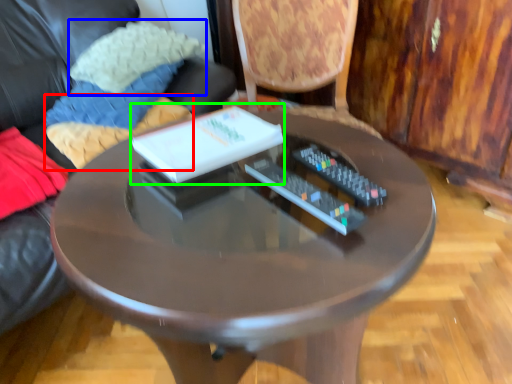
Question: Which is nearer to the pillow (highlighted by a red box)? pillow (highlighted by a blue box) or book (highlighted by a green box).

Choices:
 (A) pillow
 (B) book

Answer: (A)